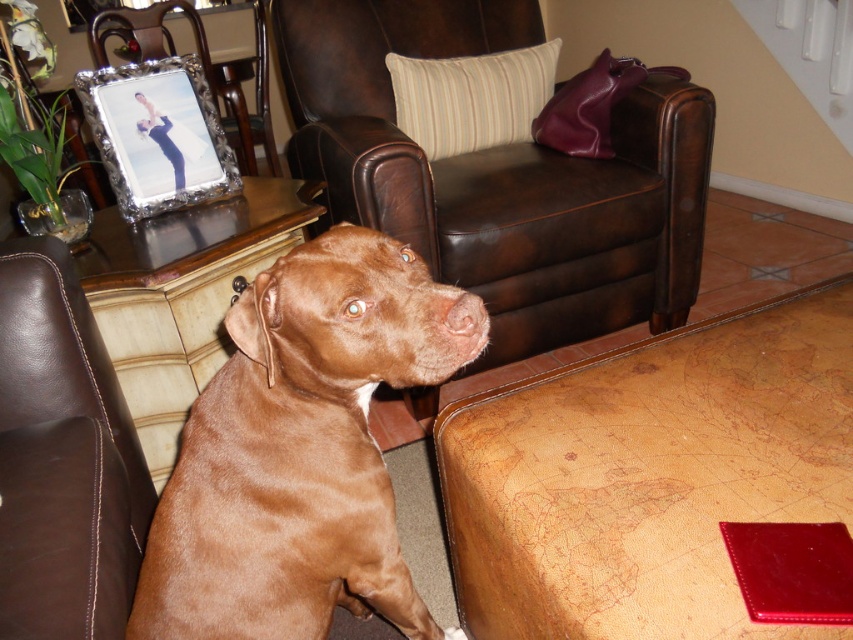
Question: Does brown leather couch at lower left appear on the right side of silver metallic frame at upper left?

Choices:
 (A) no
 (B) yes

Answer: (B)

Question: Which point is farther to the camera?

Choices:
 (A) brown leather couch at lower left
 (B) brown leather armchair at center
 (C) silver metallic frame at upper left
 (D) brown smooth dog at center

Answer: (C)

Question: Based on their relative distances, which object is nearer to the brown smooth dog at center?

Choices:
 (A) silver metallic frame at upper left
 (B) brown leather couch at lower left

Answer: (B)

Question: Does brown leather armchair at center have a smaller size compared to brown smooth dog at center?

Choices:
 (A) no
 (B) yes

Answer: (A)

Question: Is brown smooth dog at center below silver metallic frame at upper left?

Choices:
 (A) no
 (B) yes

Answer: (B)

Question: Which object is positioned farthest from the brown leather armchair at center?

Choices:
 (A) silver metallic frame at upper left
 (B) brown smooth dog at center
 (C) brown leather couch at lower left

Answer: (B)